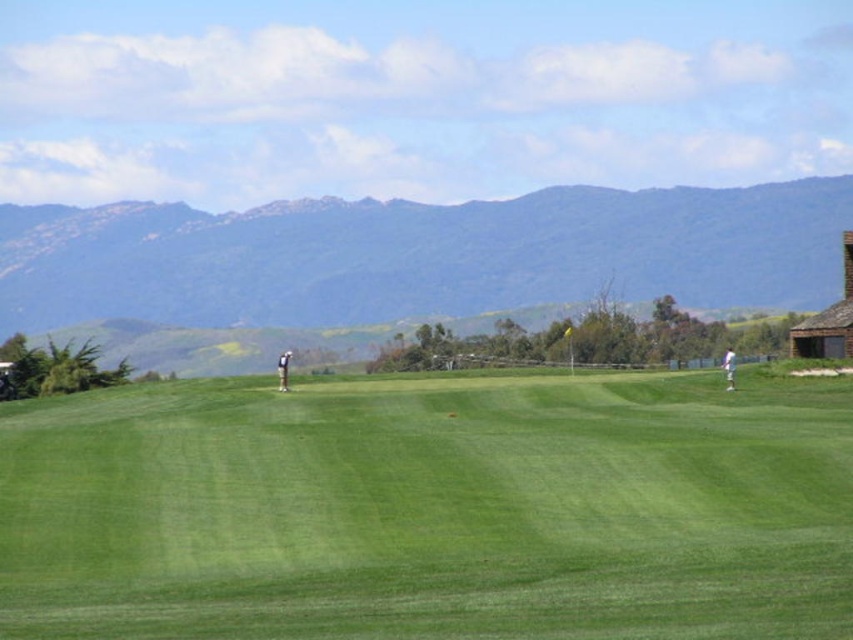
Is green grassy field at center closer to camera compared to green forested mountain at upper center?

Yes, green grassy field at center is closer to the viewer.

Does green grassy field at center have a larger size compared to green forested mountain at upper center?

No.

I want to click on green grassy field at center, so click(x=431, y=509).

Locate an element on the screen. green grassy field at center is located at coordinates (431, 509).

Does white cotton shirt at right appear over white fabric shirt at center?

Yes.

Who is shorter, white cotton shirt at right or white fabric shirt at center?

Standing shorter between the two is white cotton shirt at right.

Which is in front, point (724, 376) or point (286, 381)?

Point (724, 376)

Find the location of `white cotton shirt at right`. white cotton shirt at right is located at coordinates (729, 368).

Is green grassy field at center thinner than white fabric shirt at center?

In fact, green grassy field at center might be wider than white fabric shirt at center.

Identify the location of green grassy field at center. This screenshot has height=640, width=853. click(x=431, y=509).

Where is `green grassy field at center`? The height and width of the screenshot is (640, 853). green grassy field at center is located at coordinates (431, 509).